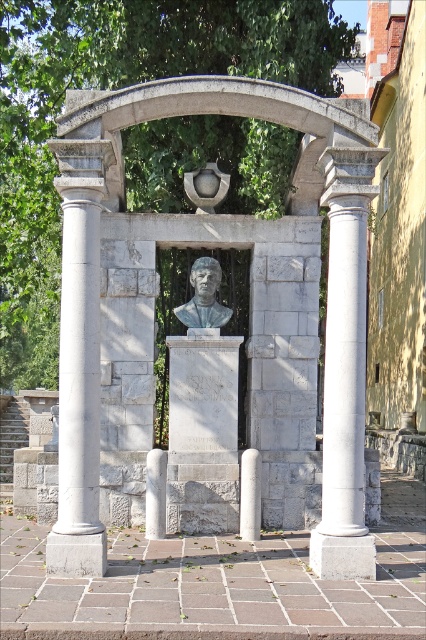
Question: Which is farther from the white marble column at center?

Choices:
 (A) gray stone column at left
 (B) matte gray bust at center

Answer: (B)

Question: Can you confirm if gray stone bust at center is positioned to the right of gray stone column at left?

Choices:
 (A) yes
 (B) no

Answer: (A)

Question: Does white marble column at center have a greater width compared to gray stone column at left?

Choices:
 (A) no
 (B) yes

Answer: (B)

Question: Does gray stone bust at center come behind matte gray bust at center?

Choices:
 (A) yes
 (B) no

Answer: (B)

Question: Based on their relative distances, which object is farther from the gray stone bust at center?

Choices:
 (A) gray stone column at left
 (B) white marble column at center
 (C) matte gray bust at center

Answer: (C)

Question: Which object is the closest to the gray stone bust at center?

Choices:
 (A) white marble column at center
 (B) gray stone column at left
 (C) matte gray bust at center

Answer: (A)